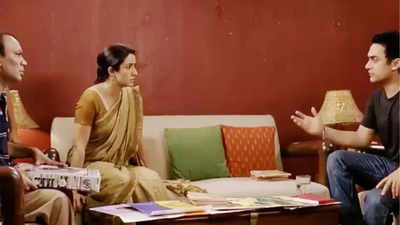
At what (x,y) coordinates should I click in order to perform the action: click on sofa. Please return your answer as a coordinate pair (x, y). Looking at the image, I should click on (151, 126).